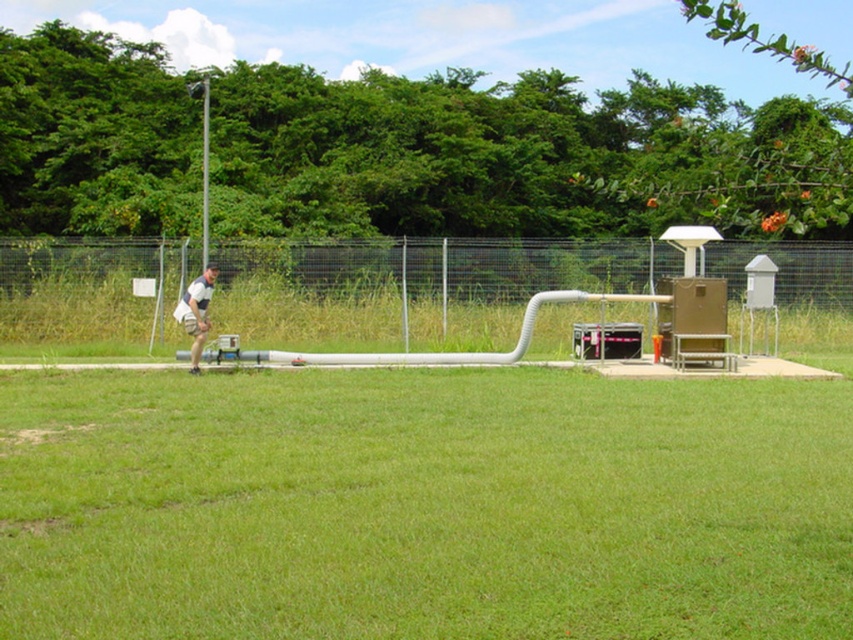
Is point (813, 560) farther from camera compared to point (155, 243)?

No, it is not.

Which is more to the right, green grass at center or metallic wire mesh fence at center?

green grass at center

What are the coordinates of `green grass at center` in the screenshot? It's located at (422, 506).

What do you see at coordinates (422, 506) in the screenshot? I see `green grass at center` at bounding box center [422, 506].

What are the coordinates of `green grass at center` in the screenshot? It's located at (422, 506).

Can you confirm if metallic wire mesh fence at center is taller than white matte shorts at center?

Correct, metallic wire mesh fence at center is much taller as white matte shorts at center.

Who is shorter, metallic wire mesh fence at center or white matte shorts at center?

white matte shorts at center

What do you see at coordinates (413, 289) in the screenshot? The image size is (853, 640). I see `metallic wire mesh fence at center` at bounding box center [413, 289].

Find the location of `metallic wire mesh fence at center`. metallic wire mesh fence at center is located at coordinates (413, 289).